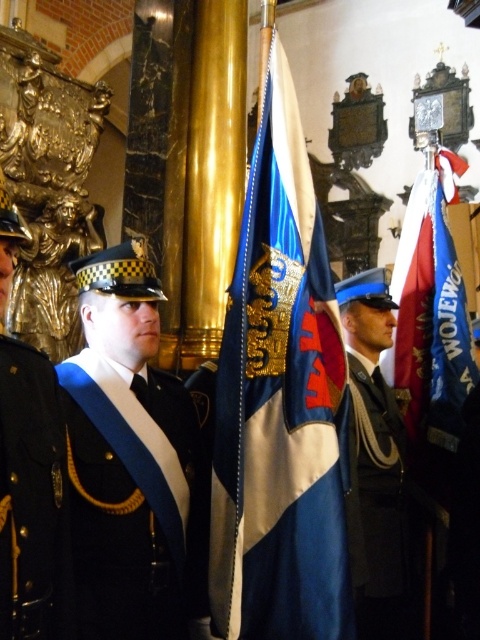
You are a photographer at the event and need to capture both flags in a single shot. The camera you have can only focus on objects within a 2 meter width. Given the distance between the two flags, can you fit both the blue fabric flag at center and the blue fabric flag at right into the frame without moving the camera?

The blue fabric flag at center is narrower than the blue fabric flag at right. However, the question about fitting both into the frame depends on the distance between them and the camera settings. Since the provided information only states the width comparison between the flags and not their spacing, it is impossible to determine if they can both fit without knowing the actual distance between them.

You are attending a formal event in a grand hall with two points marked on the floor. The first point is at coordinates point [423,349] and the second is at point [50,369]. From your perspective standing at the entrance, which point is closer to the back wall?

Point [423,349] is behind point [50,369], so it is closer to the back wall.

You are attending a formal event in the grand hall and notice two items at the center of the scene. Which one is closer to you between the blue fabric flag at center and the black leather uniform at center?

The blue fabric flag at center is closer to you than the black leather uniform at center according to the description.